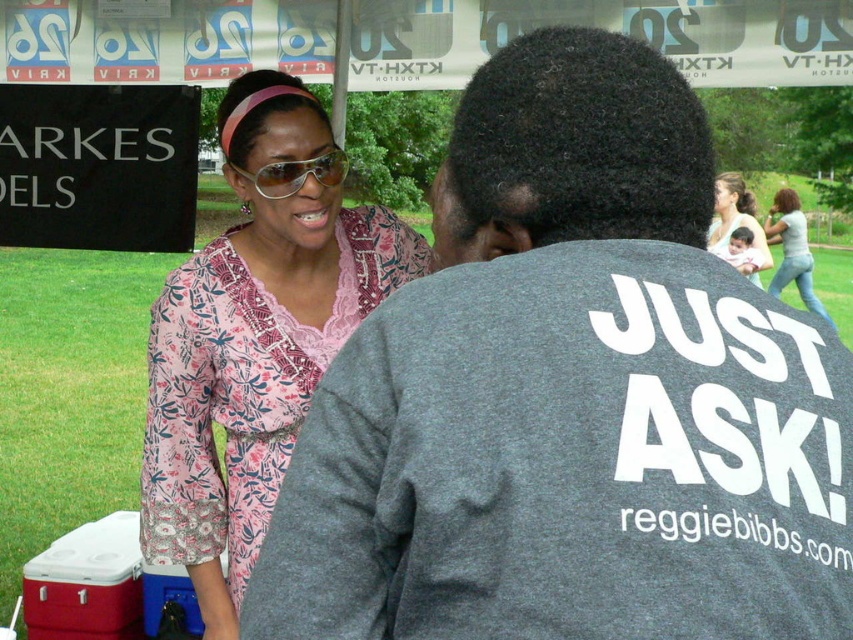
Question: Considering the relative positions of jeans at center and sunglasses at center in the image provided, where is jeans at center located with respect to sunglasses at center?

Choices:
 (A) below
 (B) above

Answer: (B)

Question: Is pink floral dress at center to the left of sunglasses at center from the viewer's perspective?

Choices:
 (A) yes
 (B) no

Answer: (B)

Question: Which object is the farthest from the jeans at center?

Choices:
 (A) pink floral dress at center
 (B) floral fabric dress at upper left

Answer: (B)

Question: Which point is farther to the camera?

Choices:
 (A) click(x=265, y=195)
 (B) click(x=186, y=371)
 (C) click(x=717, y=237)

Answer: (C)

Question: Which object is farther from the camera taking this photo?

Choices:
 (A) sunglasses at center
 (B) floral fabric dress at upper left
 (C) gray cotton t-shirt at center
 (D) pink floral dress at center

Answer: (D)

Question: Is gray cotton t-shirt at center positioned before jeans at center?

Choices:
 (A) yes
 (B) no

Answer: (A)